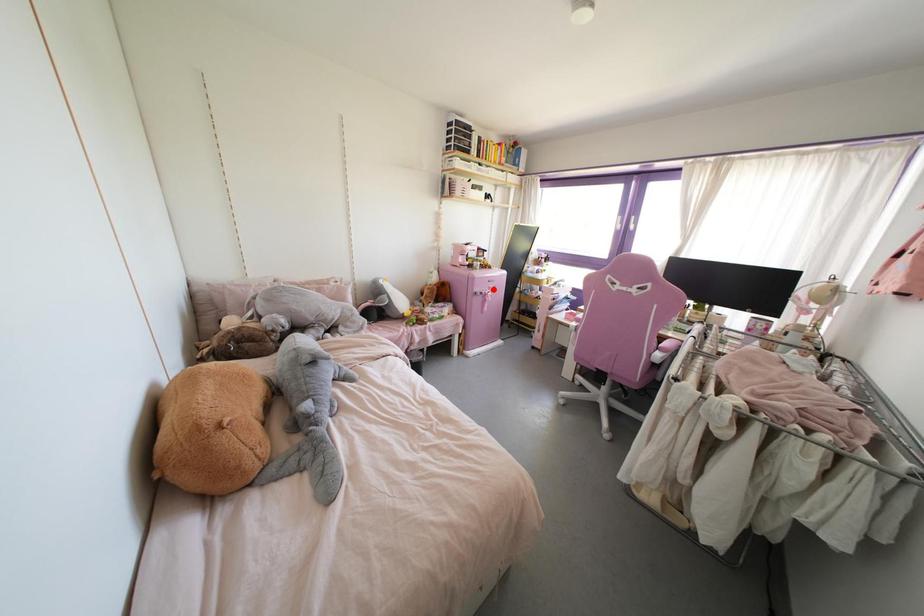
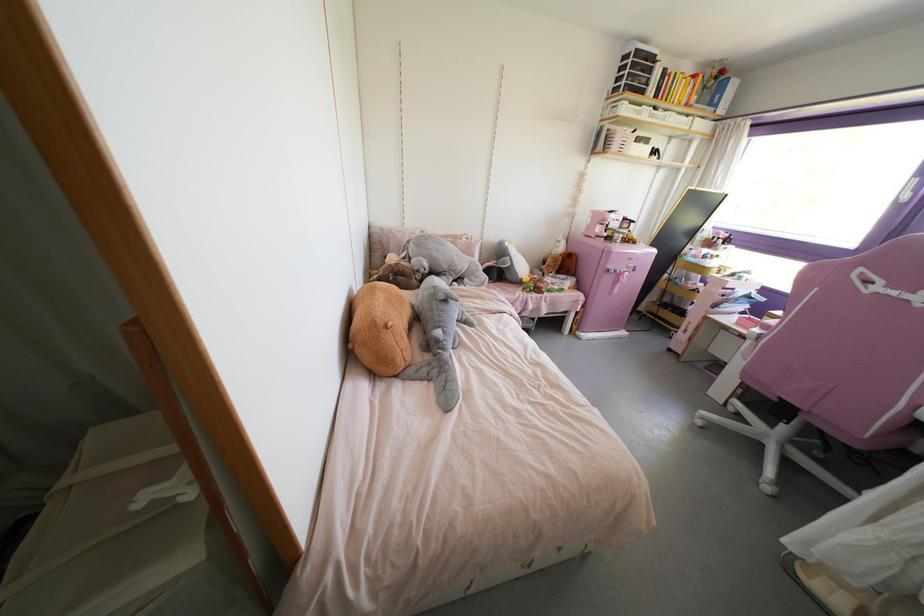
Find the pixel in the second image that matches the highlighted location in the first image.

(633, 270)